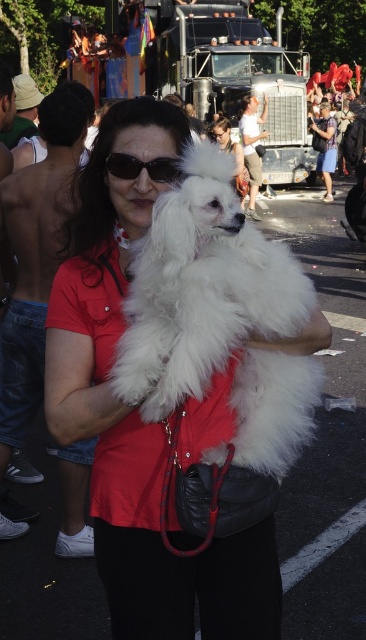
Who is more forward, (266,243) or (151,172)?

Point (151,172)

Who is more distant from viewer, (x=225, y=326) or (x=152, y=179)?

The point (x=152, y=179) is more distant.

Where is `white fluffy dog at center`? The width and height of the screenshot is (366, 640). white fluffy dog at center is located at coordinates (200, 289).

Can you confirm if white fluffy dog at center is positioned to the right of matte black dog at center?

In fact, white fluffy dog at center is to the left of matte black dog at center.

Does point (136, 259) lie in front of point (215, 125)?

That is True.

Describe the element at coordinates (200, 289) in the screenshot. This screenshot has width=366, height=640. I see `white fluffy dog at center` at that location.

The image size is (366, 640). Find the location of `white fluffy dog at center`. white fluffy dog at center is located at coordinates (200, 289).

The height and width of the screenshot is (640, 366). Find the location of `white fluffy dog at center`. white fluffy dog at center is located at coordinates (200, 289).

How distant is white fluffy dog at center from matte red shirt at center?

white fluffy dog at center is 8.81 inches away from matte red shirt at center.

Which is in front, point (143, 364) or point (236, 582)?

Positioned in front is point (143, 364).

Where is `white fluffy dog at center`? Image resolution: width=366 pixels, height=640 pixels. white fluffy dog at center is located at coordinates (200, 289).